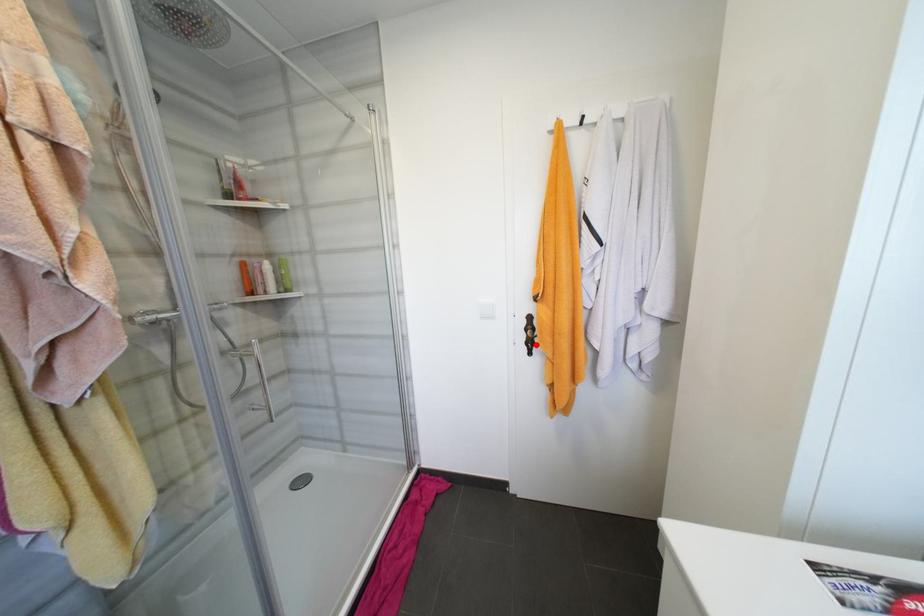
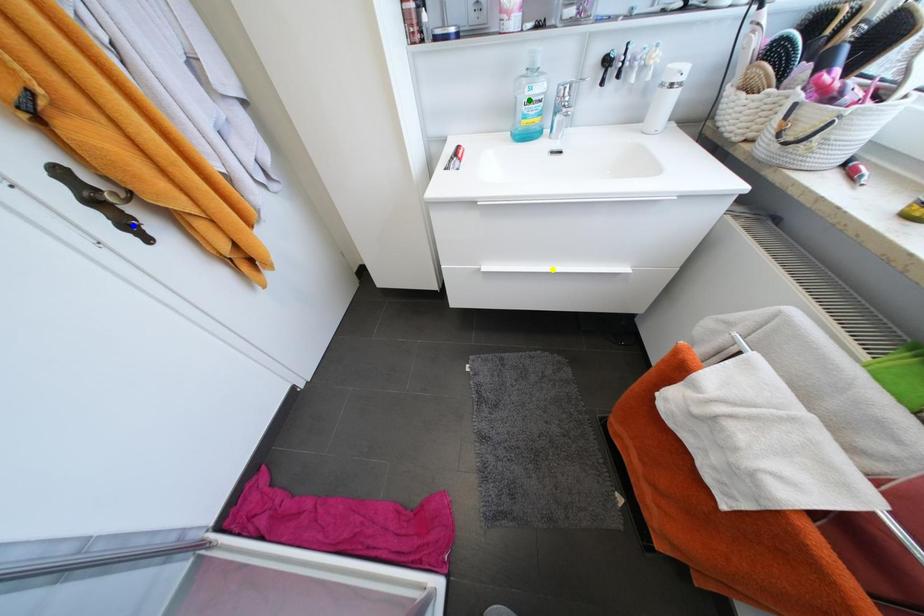
Question: I am providing you with two images of the same scene from different viewpoints. A red point is marked on the first image. You are given multiple points on the second image. Which point in image 2 represents the same 3d spot as the red point in image 1?

Choices:
 (A) green point
 (B) yellow point
 (C) blue point

Answer: (C)